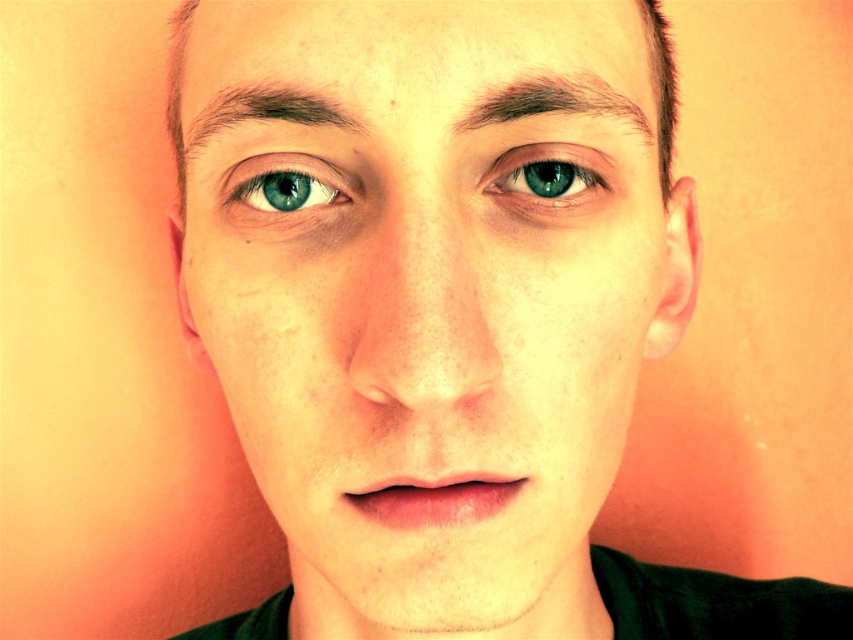
Can you confirm if green glossy eye at center is positioned above brown hair at upper center?

Incorrect, green glossy eye at center is not positioned above brown hair at upper center.

Between green glossy eye at center and brown hair at upper center, which one is positioned higher?

brown hair at upper center

Between point (508, 157) and point (285, 118), which one is positioned behind?

The point (508, 157) is behind.

Identify the location of green glossy eye at center. Image resolution: width=853 pixels, height=640 pixels. (547, 173).

Is smooth skin face at center positioned before green glossy eye at center?

That is True.

Who is taller, smooth skin face at center or green glossy eye at center?

smooth skin face at center

Which is behind, point (294, 220) or point (563, 150)?

Point (294, 220)

Where is `smooth skin face at center`? The image size is (853, 640). smooth skin face at center is located at coordinates (427, 298).

Who is higher up, green glossy eye at center or blue glossy eye at center?

A: green glossy eye at center is higher up.

Is green glossy eye at center wider than blue glossy eye at center?

Incorrect, green glossy eye at center's width does not surpass blue glossy eye at center's.

You are a GUI agent. You are given a task and a screenshot of the screen. Output one action in this format:
    pyautogui.click(x=<x>, y=<y>)
    Task: Click on the green glossy eye at center
    This screenshot has height=640, width=853.
    Given the screenshot: What is the action you would take?
    pyautogui.click(x=547, y=173)